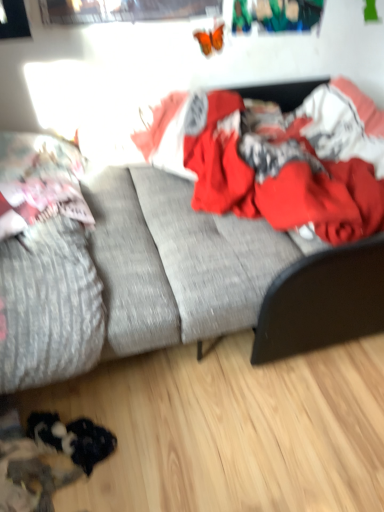
Question: Is red cotton blanket at center oriented towards textured gray mattress at left?

Choices:
 (A) yes
 (B) no

Answer: (B)

Question: Can you confirm if red cotton blanket at center is thinner than textured gray mattress at left?

Choices:
 (A) yes
 (B) no

Answer: (B)

Question: Is red cotton blanket at center to the left of textured gray mattress at left from the viewer's perspective?

Choices:
 (A) no
 (B) yes

Answer: (A)

Question: Is red cotton blanket at center behind textured gray mattress at left?

Choices:
 (A) no
 (B) yes

Answer: (B)

Question: Is red cotton blanket at center completely or partially outside of textured gray mattress at left?

Choices:
 (A) no
 (B) yes

Answer: (B)

Question: Can textured gray mattress at left be found inside red cotton blanket at center?

Choices:
 (A) no
 (B) yes

Answer: (A)

Question: From the image's perspective, is red cotton blanket at center over fluffy pink pillow at left?

Choices:
 (A) yes
 (B) no

Answer: (A)

Question: Is red cotton blanket at center further to the viewer compared to fluffy pink pillow at left?

Choices:
 (A) yes
 (B) no

Answer: (B)

Question: Is red cotton blanket at center facing towards fluffy pink pillow at left?

Choices:
 (A) no
 (B) yes

Answer: (A)

Question: Is red cotton blanket at center far away from fluffy pink pillow at left?

Choices:
 (A) no
 (B) yes

Answer: (A)

Question: Does red cotton blanket at center appear on the right side of fluffy pink pillow at left?

Choices:
 (A) yes
 (B) no

Answer: (A)

Question: From a real-world perspective, does red cotton blanket at center stand above fluffy pink pillow at left?

Choices:
 (A) no
 (B) yes

Answer: (B)

Question: Is textured gray couch at center outside red cotton blanket at center?

Choices:
 (A) yes
 (B) no

Answer: (A)